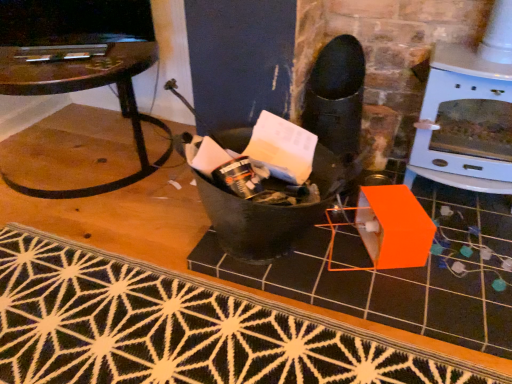
Question: Considering the relative sizes of clear glass table at left and black matte tile at center in the image provided, is clear glass table at left wider than black matte tile at center?

Choices:
 (A) no
 (B) yes

Answer: (A)

Question: Would you say clear glass table at left is a long distance from black matte tile at center?

Choices:
 (A) no
 (B) yes

Answer: (B)

Question: Considering the relative sizes of clear glass table at left and black matte tile at center in the image provided, is clear glass table at left thinner than black matte tile at center?

Choices:
 (A) no
 (B) yes

Answer: (B)

Question: From the image's perspective, is clear glass table at left beneath black matte tile at center?

Choices:
 (A) no
 (B) yes

Answer: (A)

Question: Considering the relative sizes of clear glass table at left and black matte tile at center in the image provided, is clear glass table at left shorter than black matte tile at center?

Choices:
 (A) no
 (B) yes

Answer: (A)

Question: In terms of width, does clear glass table at left look wider or thinner when compared to black matte tile at center?

Choices:
 (A) wide
 (B) thin

Answer: (B)

Question: Based on their sizes in the image, would you say clear glass table at left is bigger or smaller than black matte tile at center?

Choices:
 (A) big
 (B) small

Answer: (A)

Question: Is clear glass table at left inside the boundaries of black matte tile at center, or outside?

Choices:
 (A) outside
 (B) inside

Answer: (A)

Question: From a real-world perspective, relative to black matte tile at center, is clear glass table at left vertically above or below?

Choices:
 (A) above
 (B) below

Answer: (A)

Question: From a real-world perspective, is black matte tile at center physically located above or below clear glass table at left?

Choices:
 (A) above
 (B) below

Answer: (B)

Question: Considering their positions, is black matte tile at center located in front of or behind clear glass table at left?

Choices:
 (A) front
 (B) behind

Answer: (A)

Question: Would you say black matte tile at center is to the left or to the right of clear glass table at left in the picture?

Choices:
 (A) right
 (B) left

Answer: (A)

Question: From the image's perspective, is black matte tile at center positioned above or below clear glass table at left?

Choices:
 (A) below
 (B) above

Answer: (A)

Question: Is black textured rug at lower center inside the boundaries of clear glass table at left, or outside?

Choices:
 (A) outside
 (B) inside

Answer: (A)

Question: Considering the positions of point [336, 331] and point [39, 79], is point [336, 331] closer or farther from the camera than point [39, 79]?

Choices:
 (A) farther
 (B) closer

Answer: (B)